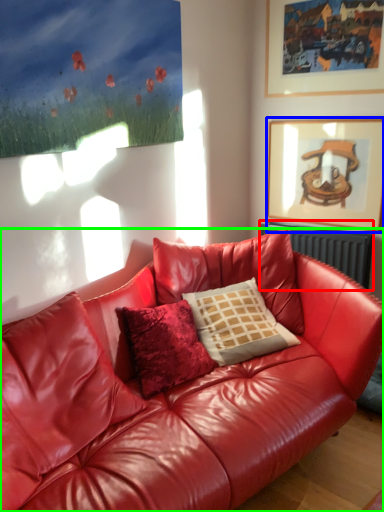
Question: Which object is positioned farthest from radiator (highlighted by a red box)? Select from picture frame (highlighted by a blue box) and studio couch (highlighted by a green box).

Choices:
 (A) picture frame
 (B) studio couch

Answer: (B)